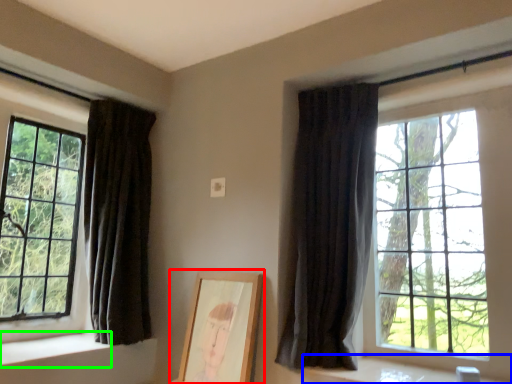
Question: Based on their relative distances, which object is farther from picture frame (highlighted by a red box)? Choose from window sill (highlighted by a blue box) and window sill (highlighted by a green box).

Choices:
 (A) window sill
 (B) window sill

Answer: (B)